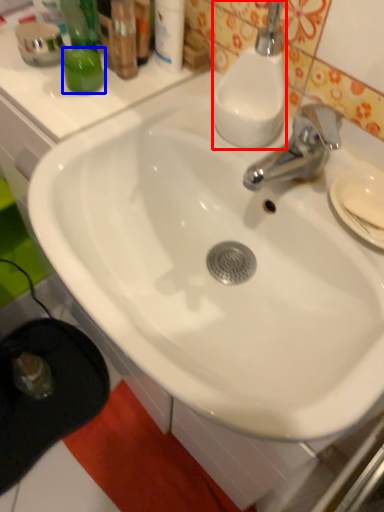
Question: Which object appears farthest to the camera in this image, soap dispenser (highlighted by a red box) or liquid (highlighted by a blue box)?

Choices:
 (A) soap dispenser
 (B) liquid

Answer: (B)